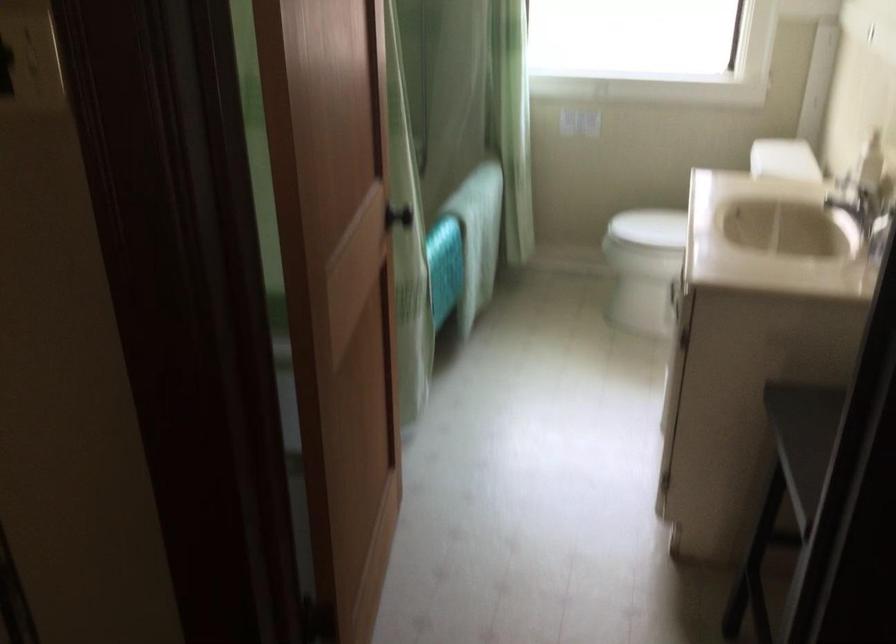
I want to click on white toilet lid, so click(x=784, y=158).